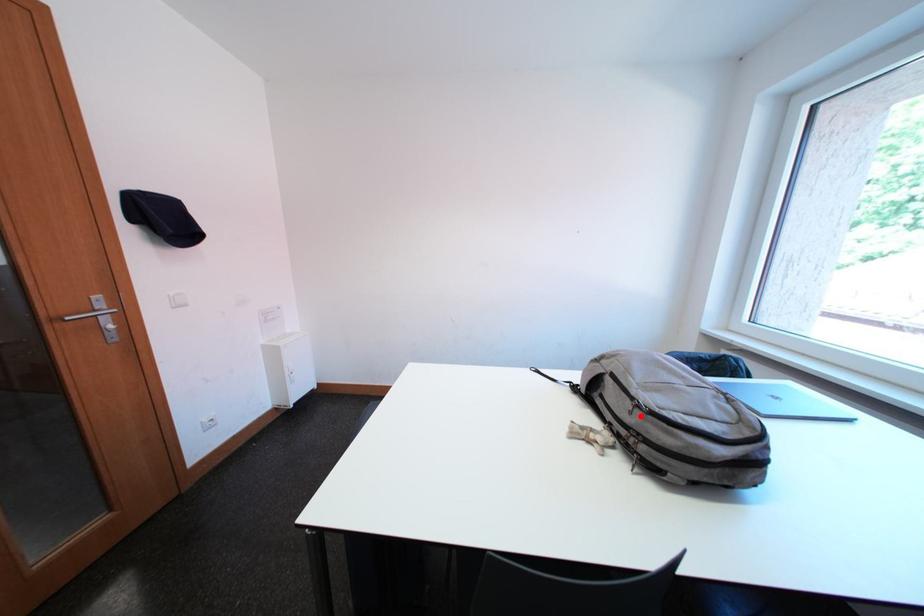
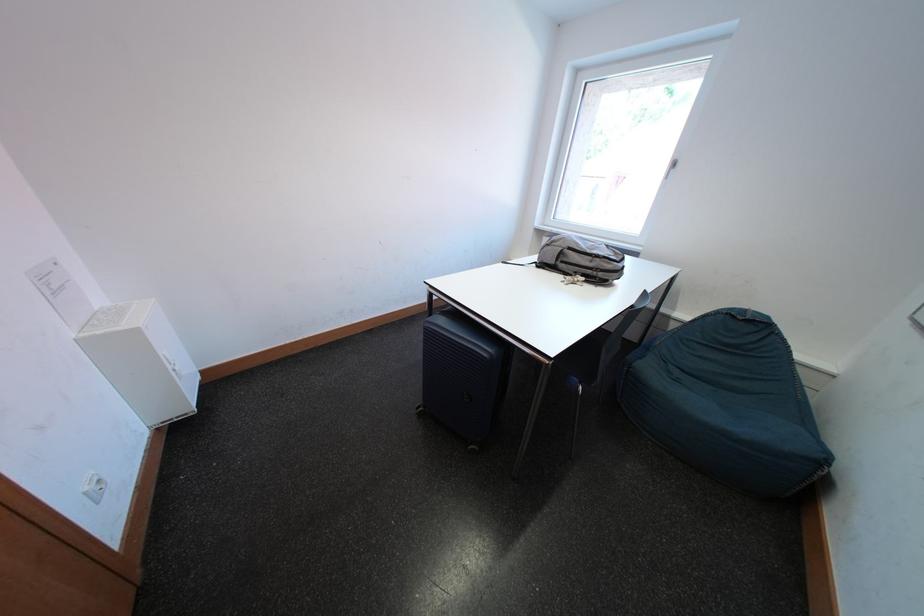
Where in the second image is the point corresponding to the highlighted location from the first image?

(601, 265)